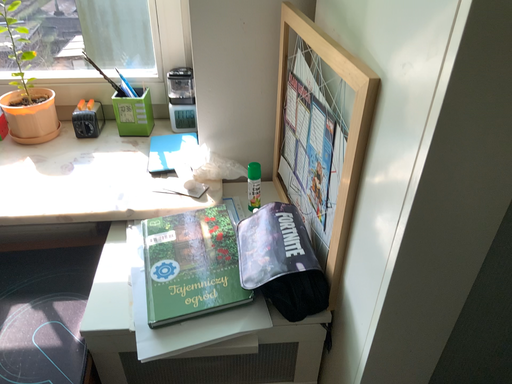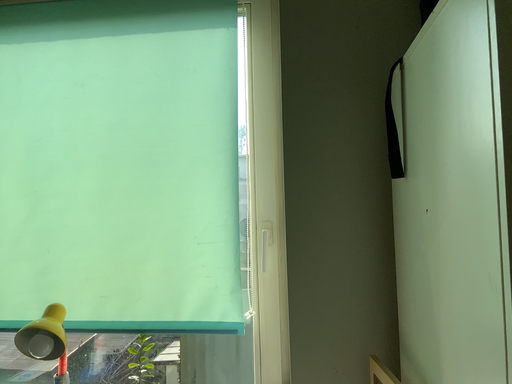
Question: Which way did the camera rotate in the video?

Choices:
 (A) rotated right
 (B) rotated left

Answer: (B)